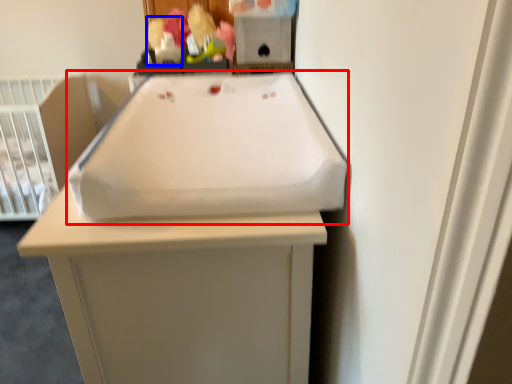
Question: Among these objects, which one is nearest to the camera, sink (highlighted by a red box) or toy (highlighted by a blue box)?

Choices:
 (A) sink
 (B) toy

Answer: (A)